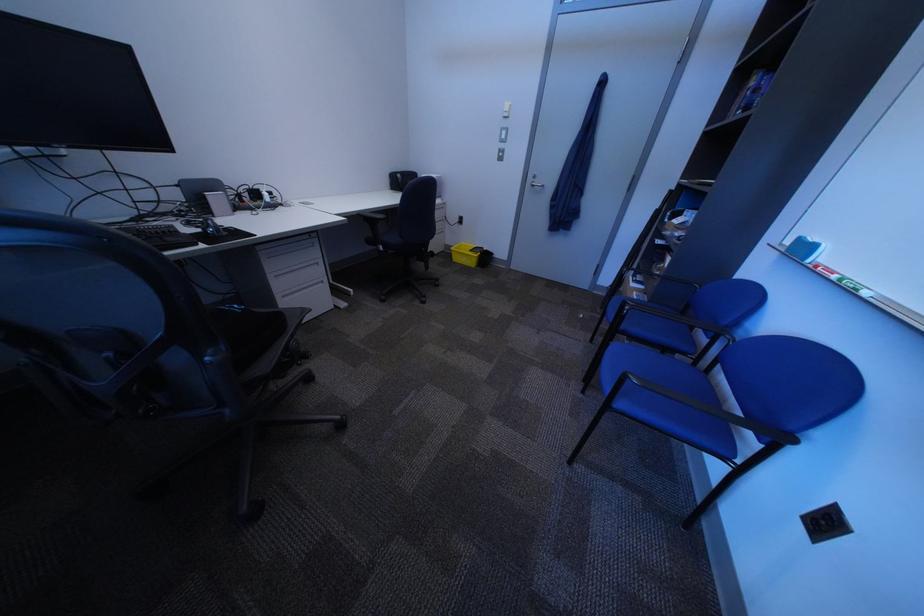
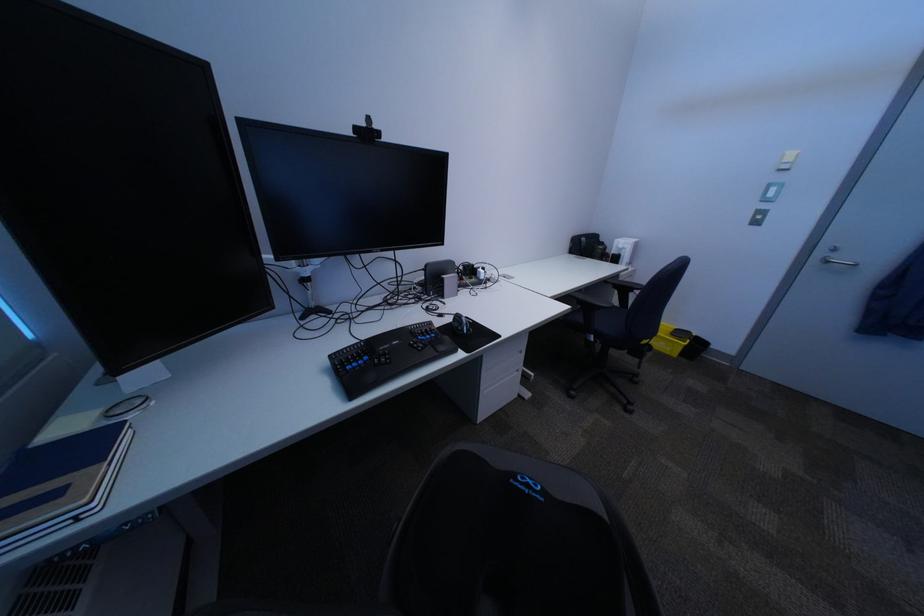
Question: The images are taken continuously from a first-person perspective. In which direction are you moving?

Choices:
 (A) Left
 (B) Right
 (C) Forward
 (D) Backward

Answer: (A)